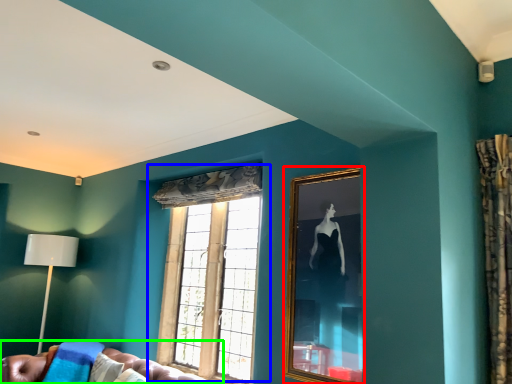
Question: Which object is the closest to the picture frame (highlighted by a red box)? Choose among these: window (highlighted by a blue box) or studio couch (highlighted by a green box).

Choices:
 (A) window
 (B) studio couch

Answer: (A)